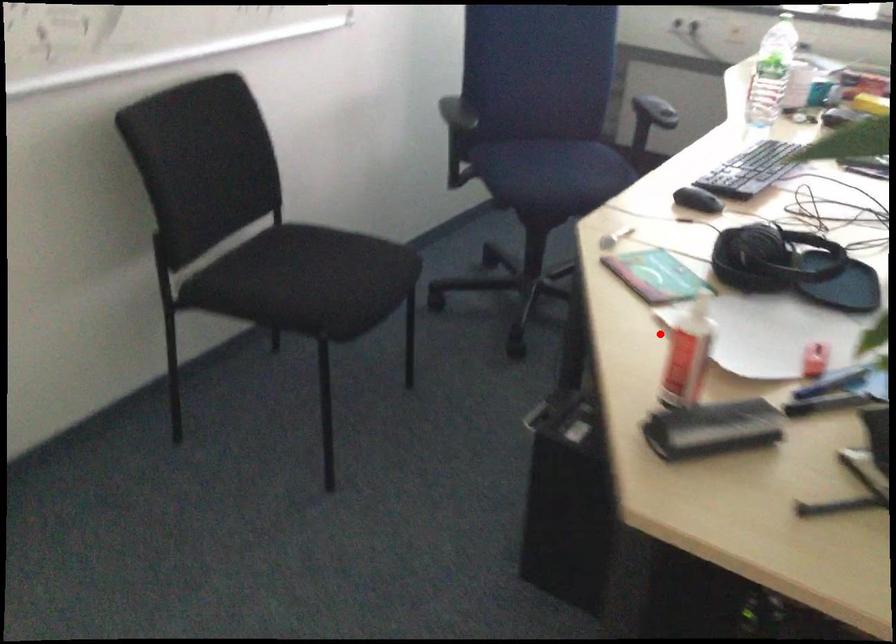
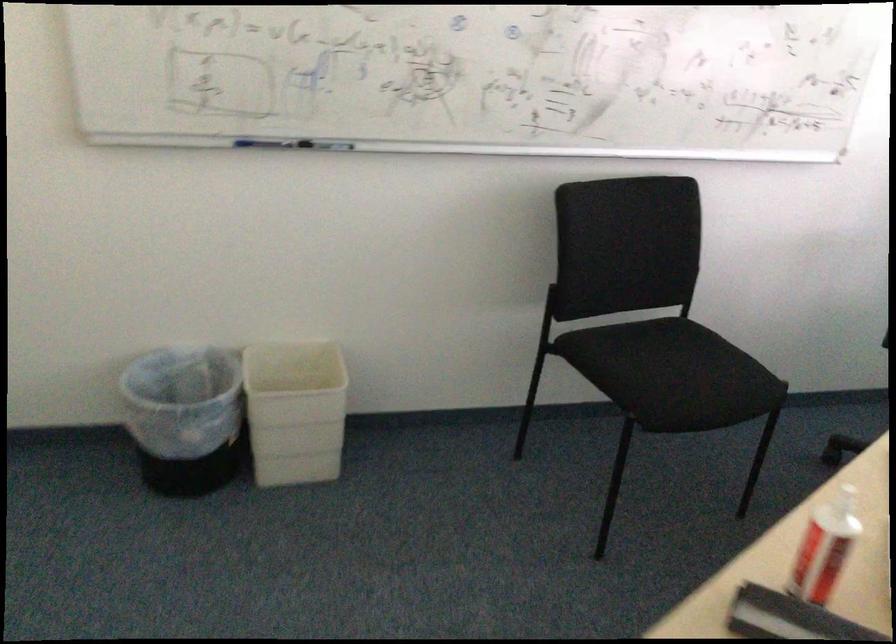
The point at the highlighted location is marked in the first image. Where is the corresponding point in the second image?

(824, 547)